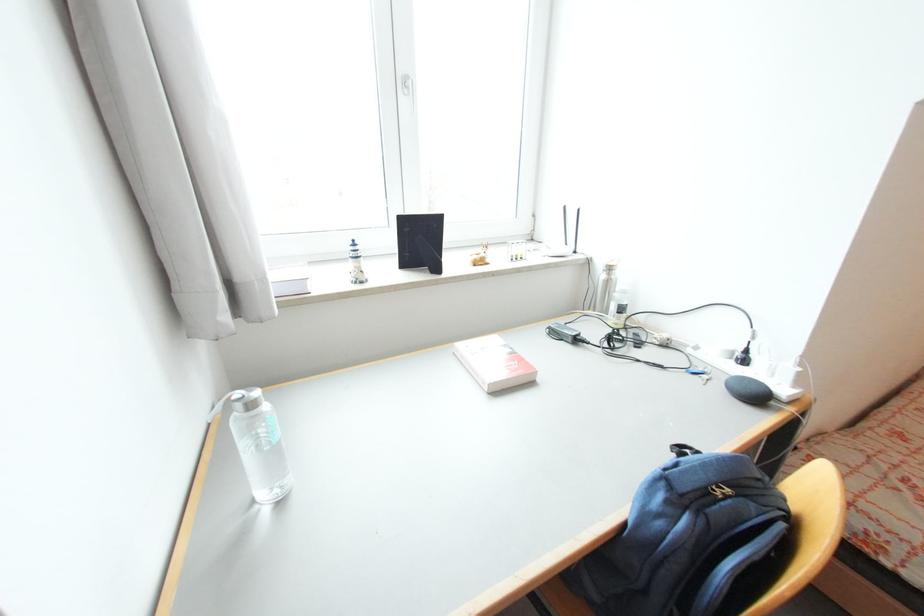
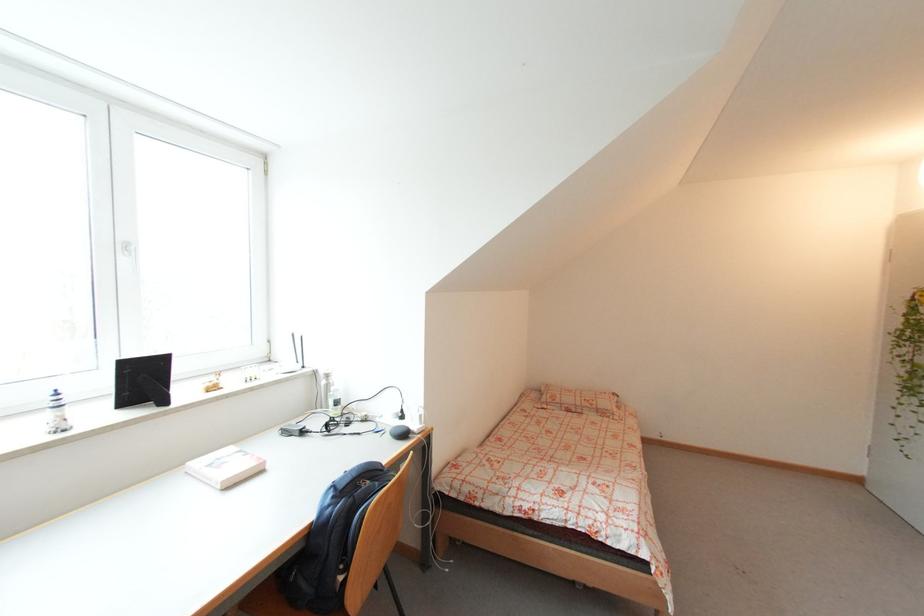
Locate, in the second image, the point that corresponds to point 411,91 in the first image.

(130, 253)